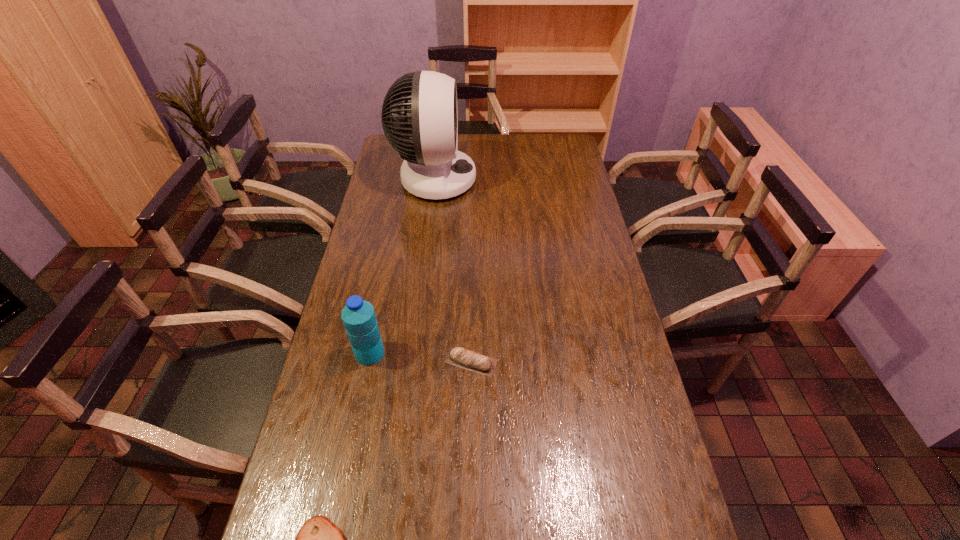
Where is `the tallest object`? Image resolution: width=960 pixels, height=540 pixels. the tallest object is located at coordinates (433, 168).

Locate an element on the screen. fan is located at coordinates (433, 168).

The image size is (960, 540). I want to click on the third shortest object, so click(358, 316).

Where is `the right pita bread`? The width and height of the screenshot is (960, 540). the right pita bread is located at coordinates (459, 357).

The width and height of the screenshot is (960, 540). Identify the location of vacant space situated 0.220m on the grille of the farthest object. (527, 179).

You are a GUI agent. You are given a task and a screenshot of the screen. Output one action in this format:
    pyautogui.click(x=<x>, y=<y>)
    Task: Click on the blank space located 0.050m on the back of the water bottle
    
    Given the screenshot: What is the action you would take?
    [375, 328]

At what (x,y) coordinates should I click in order to perform the action: click on free space located on the front of the right pita bread. Please return your answer as a coordinate pair (x, y). This screenshot has width=960, height=540. Looking at the image, I should click on (468, 487).

Where is `object that is at the far edge`? The height and width of the screenshot is (540, 960). object that is at the far edge is located at coordinates (x=433, y=168).

This screenshot has width=960, height=540. I want to click on fan located in the left edge section of the desktop, so click(x=433, y=168).

Locate an element on the screen. The width and height of the screenshot is (960, 540). water bottle that is at the left edge is located at coordinates (358, 316).